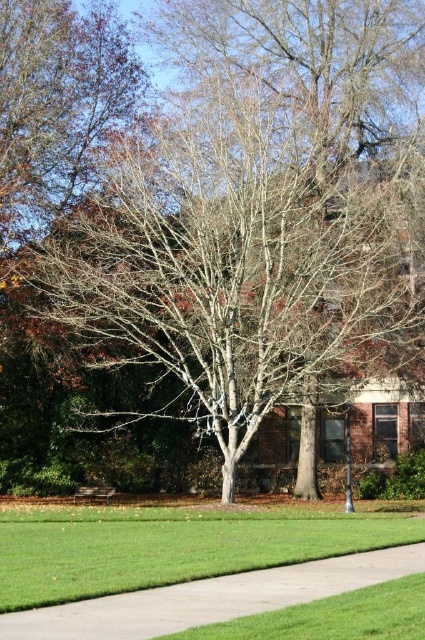
Which is more to the right, bare branches at center or wooden park bench at center?

Positioned to the right is bare branches at center.

Which of these two, bare branches at center or wooden park bench at center, stands shorter?

Standing shorter between the two is wooden park bench at center.

Is point (302, 150) positioned in front of point (96, 497)?

No, (302, 150) is further to viewer.

You are a GUI agent. You are given a task and a screenshot of the screen. Output one action in this format:
    pyautogui.click(x=<x>, y=<y>)
    Task: Click on the bare branches at center
    
    Given the screenshot: What is the action you would take?
    pyautogui.click(x=232, y=268)

Is bare branches at center smaller than gray concrete sidewalk at lower center?

Incorrect, bare branches at center is not smaller in size than gray concrete sidewalk at lower center.

The image size is (425, 640). Find the location of `bare branches at center`. bare branches at center is located at coordinates (232, 268).

Find the location of a particular element. The image size is (425, 640). bare branches at center is located at coordinates (232, 268).

Who is positioned more to the left, gray concrete sidewalk at lower center or wooden park bench at center?

wooden park bench at center

Which is behind, point (133, 618) or point (104, 493)?

The point (104, 493) is more distant.

Locate an element on the screen. gray concrete sidewalk at lower center is located at coordinates (210, 598).